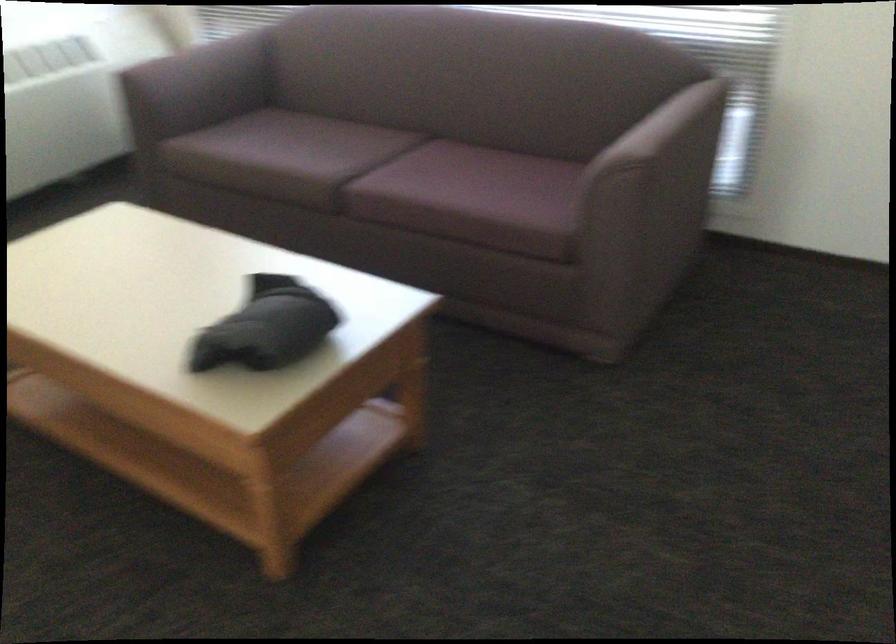
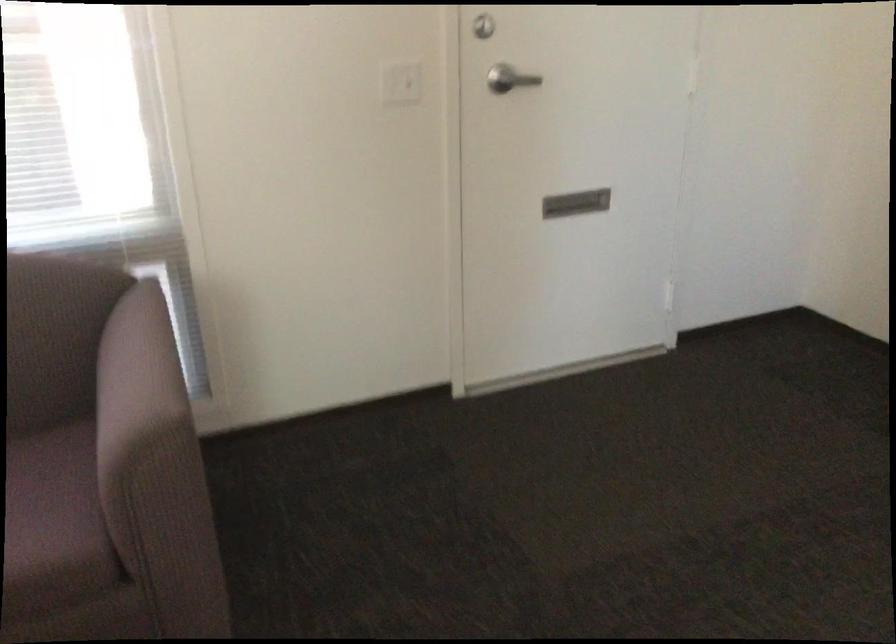
Find the pixel in the second image that matches (556,209) in the first image.

(53, 520)